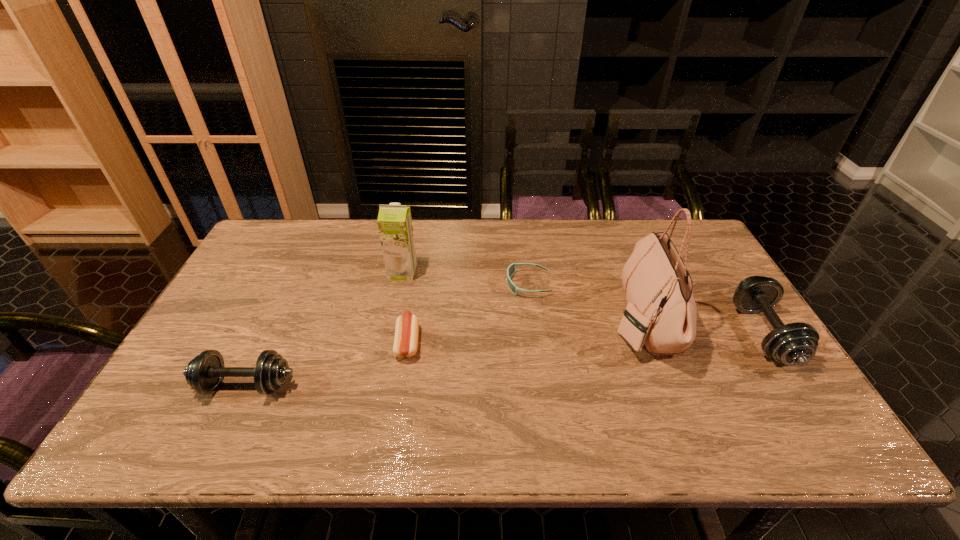
Find the location of a particular element. This screenshot has width=960, height=540. the left dumbbell is located at coordinates (204, 373).

What are the coordinates of `the third shortest object` in the screenshot? It's located at (204, 373).

Image resolution: width=960 pixels, height=540 pixels. I want to click on the right dumbbell, so click(x=792, y=344).

Find the location of a particular element. The width and height of the screenshot is (960, 540). the third tallest object is located at coordinates (792, 344).

Locate an element on the screen. The width and height of the screenshot is (960, 540). goggles is located at coordinates (511, 269).

Locate an element on the screen. This screenshot has width=960, height=540. sausage is located at coordinates (407, 326).

Where is `the second tallest object`? The width and height of the screenshot is (960, 540). the second tallest object is located at coordinates (394, 221).

Identify the location of handbag. (661, 312).

Where is `the fifth object from left to right`? The width and height of the screenshot is (960, 540). the fifth object from left to right is located at coordinates (661, 312).

Find the location of `blank space located on the right of the third shortest object`. blank space located on the right of the third shortest object is located at coordinates (388, 385).